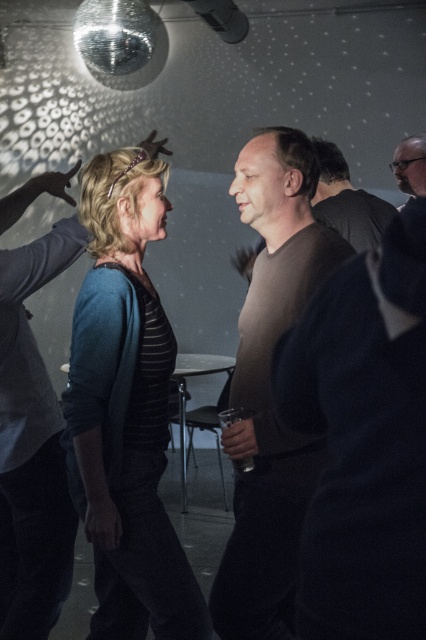
Question: Is the position of blue knit sweater at left more distant than that of dark brown leather jacket at center?

Choices:
 (A) no
 (B) yes

Answer: (A)

Question: Estimate the real-world distances between objects in this image. Which object is farther from the blue knit sweater at left?

Choices:
 (A) dark brown leather jacket at center
 (B) bearded man at upper right

Answer: (B)

Question: Which object is closer to the camera taking this photo?

Choices:
 (A) blue knit sweater at left
 (B) dark brown leather jacket at center
 (C) bearded man at upper right
 (D) brown matte shirt at center

Answer: (D)

Question: Is dark brown leather jacket at center positioned in front of bearded man at upper right?

Choices:
 (A) yes
 (B) no

Answer: (A)

Question: Which object appears closest to the camera in this image?

Choices:
 (A) dark brown leather jacket at center
 (B) blue knit sweater at left
 (C) bearded man at upper right
 (D) brown matte shirt at center

Answer: (D)

Question: Can you confirm if dark brown leather jacket at center is wider than bearded man at upper right?

Choices:
 (A) no
 (B) yes

Answer: (B)